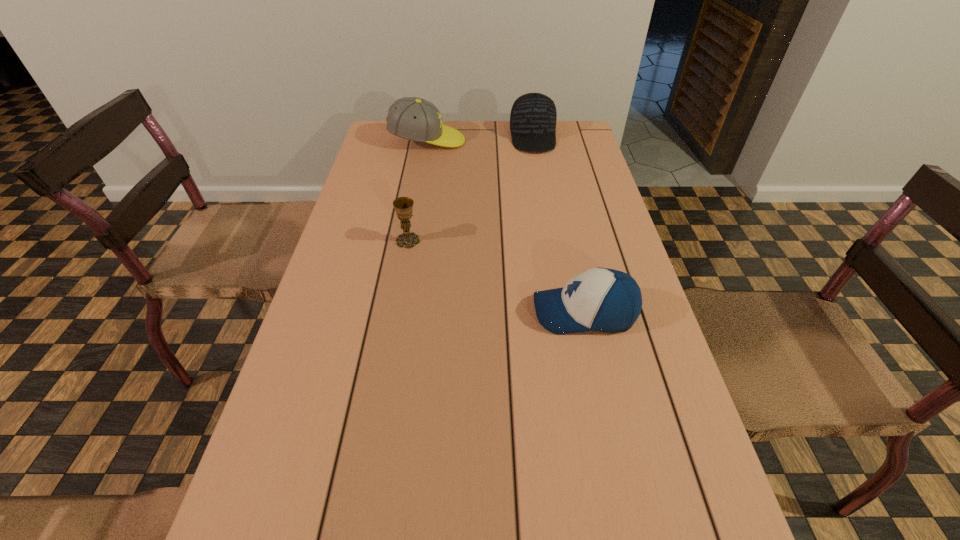
Select which object is the third closest to the third farthest object. Please provide its 2D coordinates. Your answer should be formatted as a tuple, i.e. [(x, y)], where the tuple contains the x and y coordinates of a point satisfying the conditions above.

[(533, 116)]

At what (x,y) coordinates should I click in order to perform the action: click on the closest object to the third farthest object. Please return your answer as a coordinate pair (x, y). Image resolution: width=960 pixels, height=540 pixels. Looking at the image, I should click on (600, 299).

Identify which baseball cap is the second nearest to the chalice. Please provide its 2D coordinates. Your answer should be formatted as a tuple, i.e. [(x, y)], where the tuple contains the x and y coordinates of a point satisfying the conditions above.

[(412, 118)]

Select which baseball cap is the closest to the leftmost baseball cap. Please provide its 2D coordinates. Your answer should be formatted as a tuple, i.e. [(x, y)], where the tuple contains the x and y coordinates of a point satisfying the conditions above.

[(533, 116)]